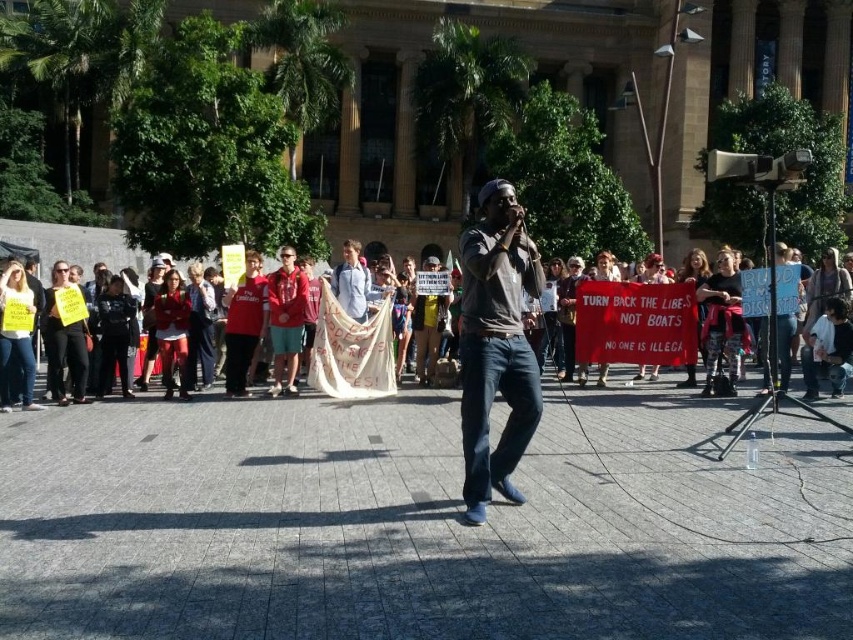
Question: Which point appears closest to the camera in this image?

Choices:
 (A) (212, 250)
 (B) (518, 372)

Answer: (B)

Question: Which point is farther from the camera taking this photo?

Choices:
 (A) (33, 248)
 (B) (479, 467)

Answer: (A)

Question: Can you confirm if matte gray shirt at center is positioned above white cotton banner at center?

Choices:
 (A) yes
 (B) no

Answer: (A)

Question: Which of the following is the closest to the observer?

Choices:
 (A) (500, 298)
 (B) (796, 378)

Answer: (A)

Question: Is matte gray shirt at center to the left of white cotton banner at center from the viewer's perspective?

Choices:
 (A) yes
 (B) no

Answer: (B)

Question: Is matte gray shirt at center further to the viewer compared to white cotton banner at center?

Choices:
 (A) yes
 (B) no

Answer: (B)